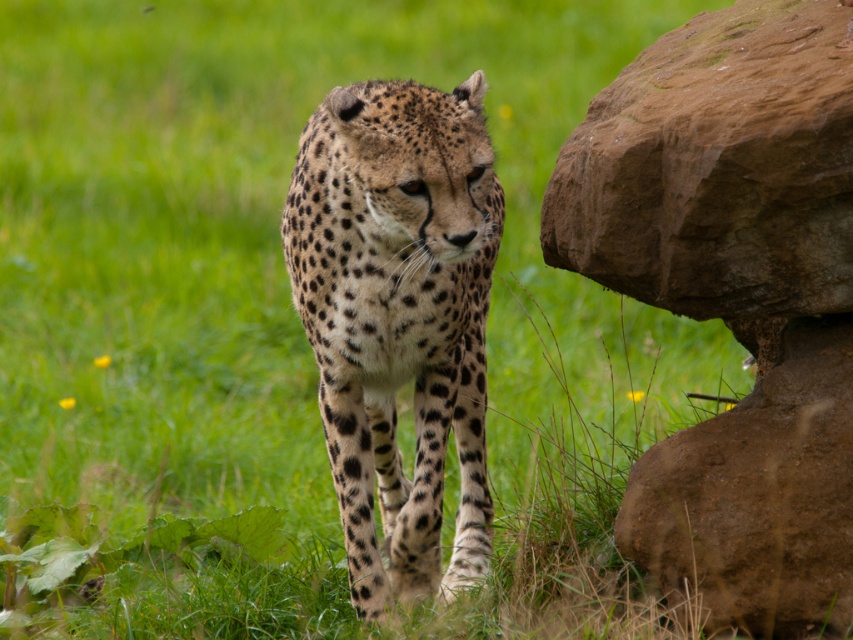
You are a wildlife photographer trying to capture a photo of the spotted fur cheetah at center and the brown rough rock at right. You want to ensure both subjects are in the frame. Based on their sizes, which object should you focus on first to ensure proper framing?

The spotted fur cheetah at center has a lesser width compared to the brown rough rock at right, so you should focus on the brown rough rock at right first to ensure it fits properly in the frame.

You are a photographer trying to capture a photo of the spotted fur cheetah at center and the brown rough rock at right. You want to ensure both subjects are visible in the frame. Based on their positions, which subject should you focus on first to include both in the shot?

The spotted fur cheetah at center is to the left of the brown rough rock at right, so you should focus on the brown rough rock at right first to ensure both are in the frame.